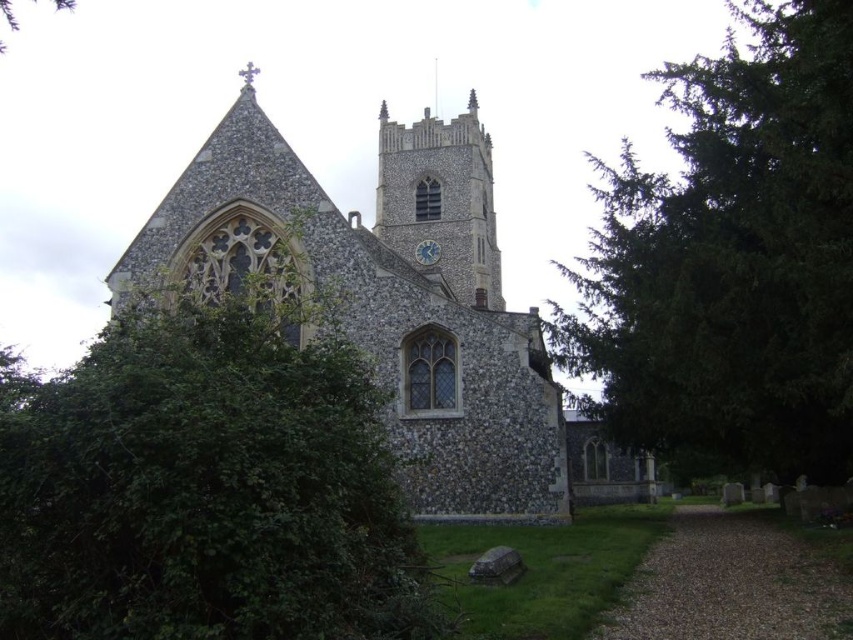
Which of these two, green textured tree at right or blue glass clock at upper center, stands taller?

green textured tree at right

Between point (622, 388) and point (436, 243), which one is positioned behind?

Point (436, 243)

Image resolution: width=853 pixels, height=640 pixels. Identify the location of green textured tree at right. (732, 260).

Is green leafy bush at left taller than stone clock tower at center?

No, green leafy bush at left is not taller than stone clock tower at center.

Does point (300, 470) lie behind point (393, 243)?

No, (300, 470) is in front of (393, 243).

This screenshot has width=853, height=640. What are the coordinates of `green leafy bush at left` in the screenshot? It's located at (206, 486).

Does green leafy bush at left appear over green textured tree at right?

No, green leafy bush at left is not above green textured tree at right.

Who is more forward, [4,568] or [744,259]?

Point [4,568]

I want to click on green leafy bush at left, so click(x=206, y=486).